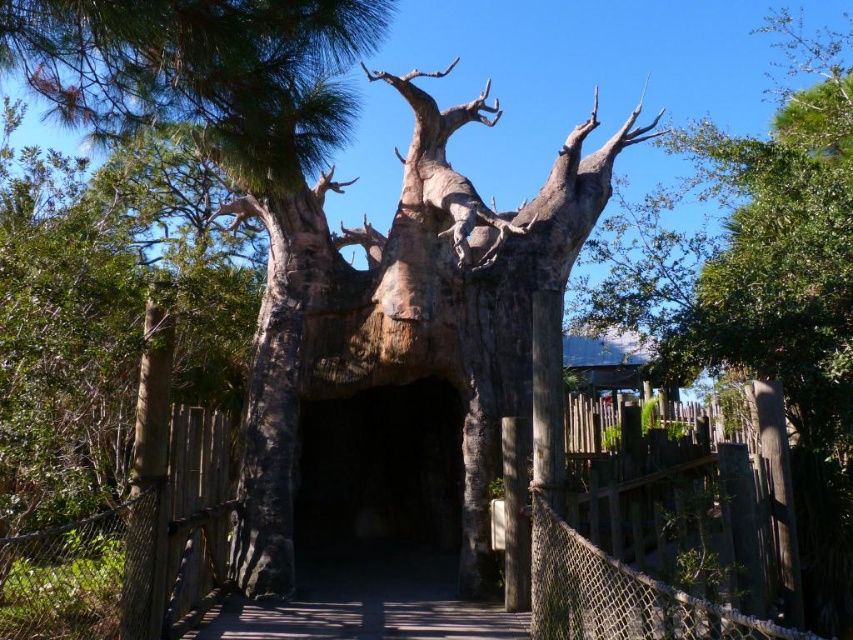
Does dark stone cave at center have a lesser width compared to wooden bridge at center?

Yes.

From the picture: Between dark stone cave at center and wooden bridge at center, which one is positioned higher?

Positioned higher is dark stone cave at center.

Does point (355, 515) come farther from viewer compared to point (339, 582)?

Yes, it is.

Find the location of a particular element. The width and height of the screenshot is (853, 640). dark stone cave at center is located at coordinates (379, 476).

Measure the distance between point (x=560, y=584) and camera.

The distance of point (x=560, y=584) from camera is 4.23 meters.

Does point (734, 456) come behind point (358, 550)?

That is False.

The image size is (853, 640). I want to click on rope bridge at center, so click(653, 554).

Where is `rope bridge at center`? The height and width of the screenshot is (640, 853). rope bridge at center is located at coordinates (653, 554).

Can you confirm if rope bridge at center is smaller than wooden bridge at center?

Yes, rope bridge at center is smaller than wooden bridge at center.

Measure the distance between rope bridge at center and camera.

The distance of rope bridge at center from camera is 5.01 meters.

This screenshot has width=853, height=640. I want to click on rope bridge at center, so (653, 554).